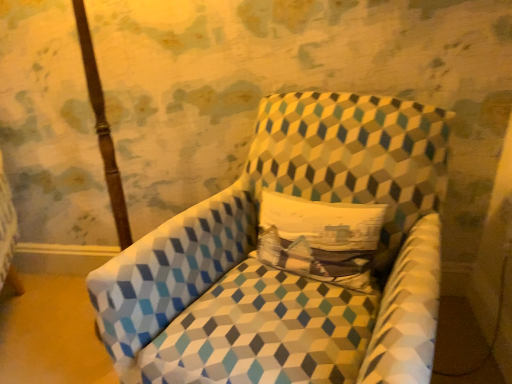
The image size is (512, 384). What do you see at coordinates (293, 256) in the screenshot?
I see `geometric-patterned fabric chair at center` at bounding box center [293, 256].

Image resolution: width=512 pixels, height=384 pixels. In order to click on geometric-patterned fabric chair at center in this screenshot , I will do `click(293, 256)`.

At what (x,y) coordinates should I click in order to perform the action: click on geometric-patterned fabric chair at center. Please return your answer as a coordinate pair (x, y). The width and height of the screenshot is (512, 384). Looking at the image, I should click on (293, 256).